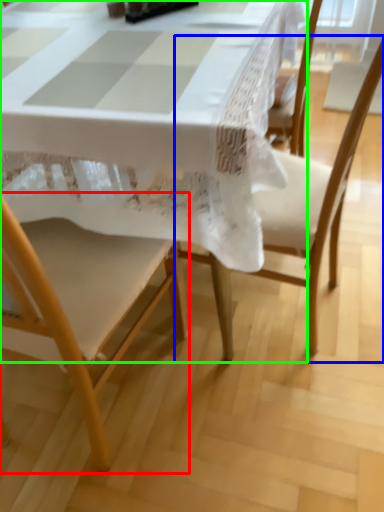
Question: Based on their relative distances, which object is nearer to chair (highlighted by a red box)? Choose from chair (highlighted by a blue box) and table (highlighted by a green box).

Choices:
 (A) chair
 (B) table

Answer: (B)